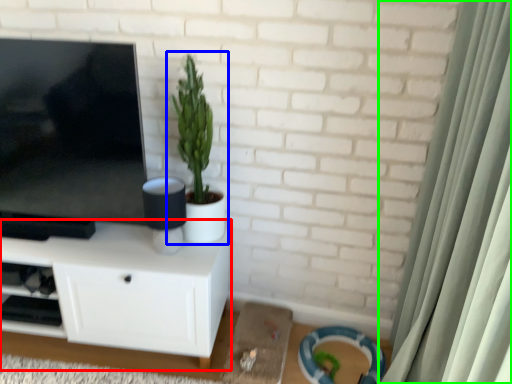
Question: Considering the real-world distances, which object is farthest from cabinetry (highlighted by a red box)? houseplant (highlighted by a blue box) or curtain (highlighted by a green box)?

Choices:
 (A) houseplant
 (B) curtain

Answer: (B)